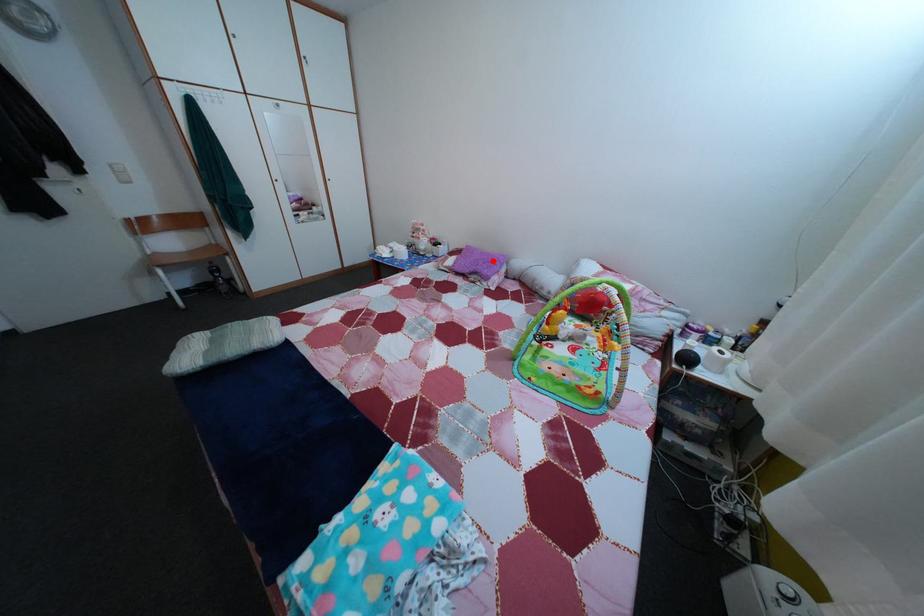
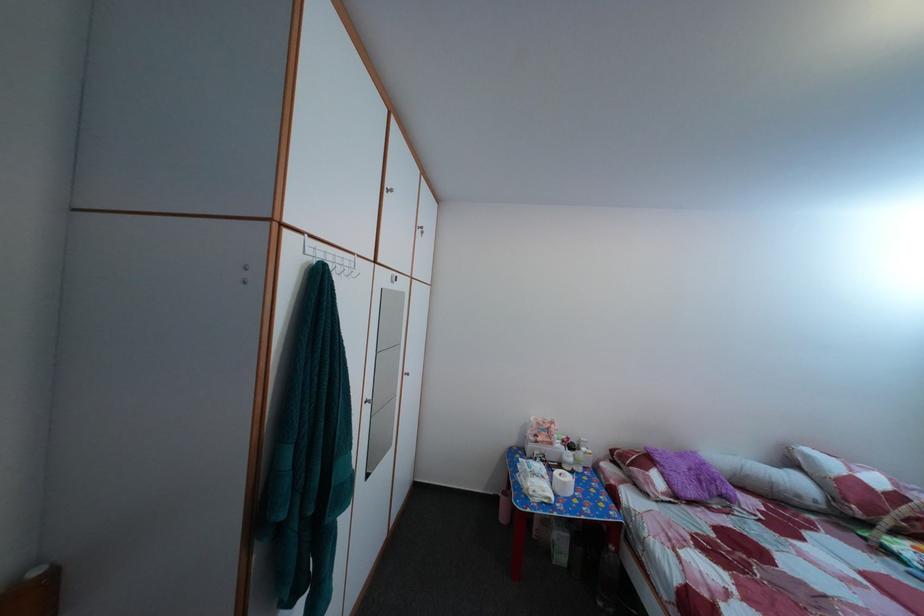
The point at the highlighted location is marked in the first image. Where is the corresponding point in the second image?

(689, 464)